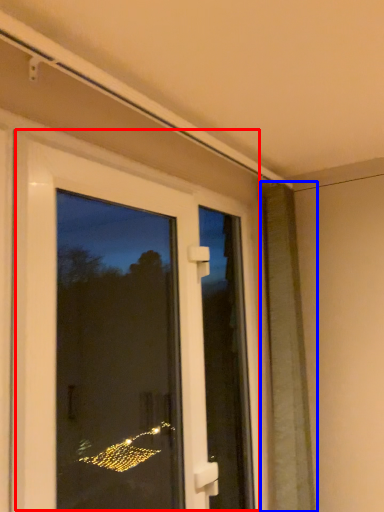
Question: Which object is further to the camera taking this photo, door (highlighted by a red box) or shutter (highlighted by a blue box)?

Choices:
 (A) door
 (B) shutter

Answer: (B)